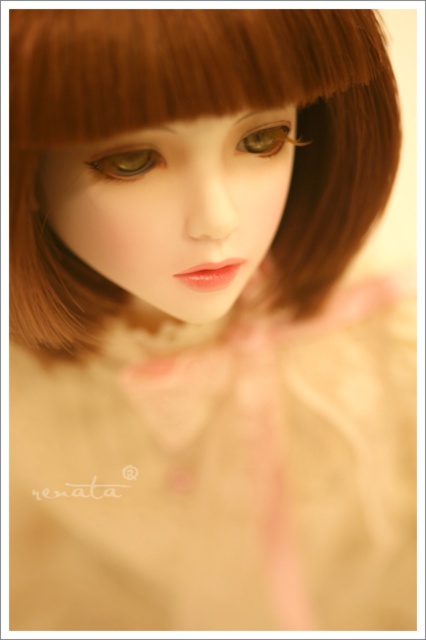
Question: Estimate the real-world distances between objects in this image. Which object is closer to the smooth porcelain face at center?

Choices:
 (A) brown matte eye at center
 (B) brown matte hair at upper center
 (C) green matte eye at center

Answer: (C)

Question: Can you confirm if brown matte hair at upper center is positioned to the left of smooth porcelain face at center?

Choices:
 (A) yes
 (B) no

Answer: (B)

Question: Is smooth porcelain face at center positioned before green matte eye at center?

Choices:
 (A) yes
 (B) no

Answer: (A)

Question: Which point is farther to the camera?

Choices:
 (A) brown matte eye at center
 (B) green matte eye at center

Answer: (A)

Question: Which point appears farthest from the camera in this image?

Choices:
 (A) (94, 72)
 (B) (118, 148)
 (C) (114, 161)

Answer: (C)

Question: Does brown matte hair at upper center lie behind brown matte eye at center?

Choices:
 (A) yes
 (B) no

Answer: (B)